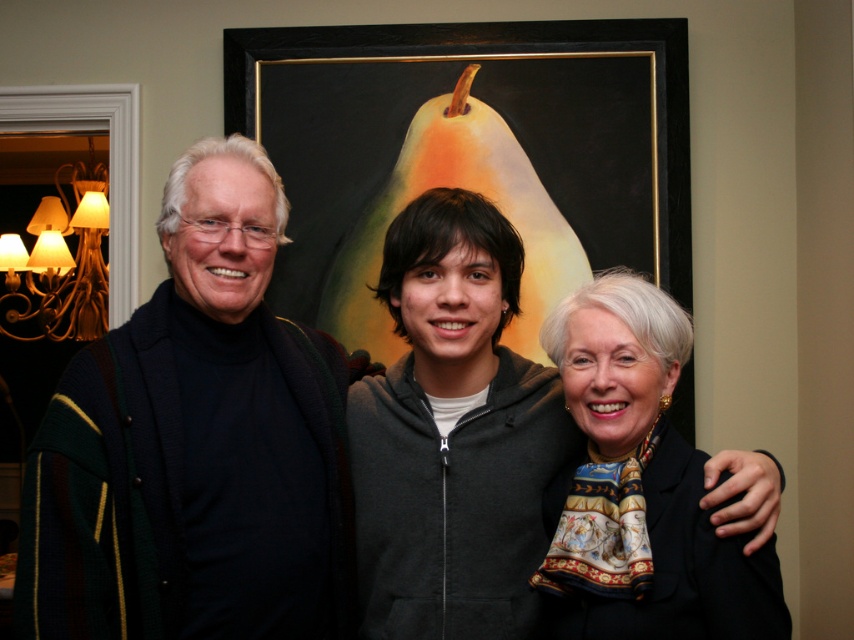
Question: Can you confirm if matte black sweater at center is positioned to the right of black glossy picture frame at upper center?

Choices:
 (A) no
 (B) yes

Answer: (A)

Question: Does matte black sweater at center appear under dark blue turtleneck sweater at left?

Choices:
 (A) yes
 (B) no

Answer: (A)

Question: Which point is closer to the camera?

Choices:
 (A) (667, 513)
 (B) (209, 147)

Answer: (A)

Question: Based on their relative distances, which object is nearer to the black glossy picture frame at upper center?

Choices:
 (A) silky black scarf at center
 (B) matte black sweater at center

Answer: (A)

Question: Estimate the real-world distances between objects in this image. Which object is closer to the black glossy picture frame at upper center?

Choices:
 (A) silky black scarf at center
 (B) dark blue turtleneck sweater at left

Answer: (A)

Question: Does dark blue turtleneck sweater at left have a larger size compared to silky black scarf at center?

Choices:
 (A) yes
 (B) no

Answer: (A)